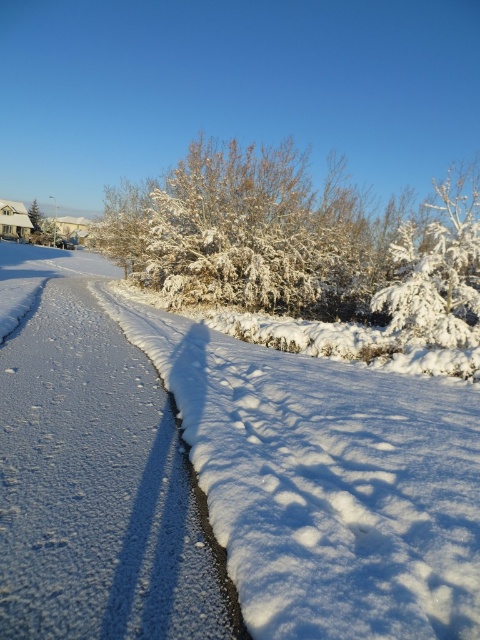
Question: Is white frosty bush at upper center thinner than white frosty bush at upper right?

Choices:
 (A) no
 (B) yes

Answer: (A)

Question: Which of the following is the closest to the observer?

Choices:
 (A) white frosty bush at upper center
 (B) white snow at center

Answer: (B)

Question: Estimate the real-world distances between objects in this image. Which object is farther from the green matte evergreen tree at upper left?

Choices:
 (A) white fluffy snow at center
 (B) white frosty bush at upper center
 (C) white frosty bush at upper right

Answer: (A)

Question: Does white fluffy snow at center appear under white snow at center?

Choices:
 (A) yes
 (B) no

Answer: (A)

Question: Among these objects, which one is farthest from the camera?

Choices:
 (A) green matte evergreen tree at upper left
 (B) white frosty bush at upper center
 (C) white fluffy snow at center
 (D) white frosty bush at upper right

Answer: (A)

Question: In this image, where is white snow at center located relative to white frosty bush at upper center?

Choices:
 (A) below
 (B) above

Answer: (A)